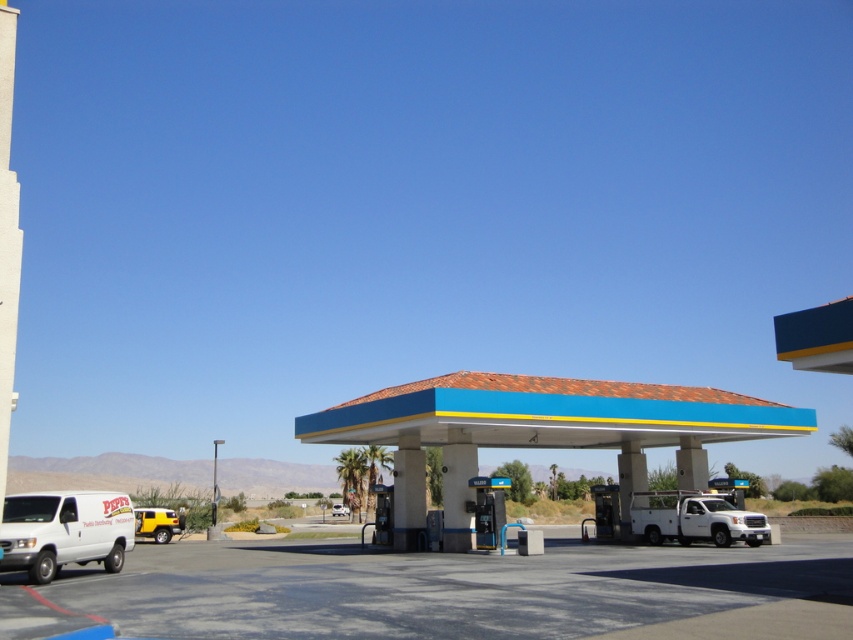
You are a delivery driver who needs to park your truck between the white matte van at lower left and the silver metallic suv at center. The truck requires a minimum of 60 meters of space to park. Can you park your truck in this location?

The distance between the white matte van at lower left and the silver metallic suv at center is 55.78 meters, which is less than the required 60 meters. Therefore, the truck cannot park between them.

You are standing at the point marked by the coordinates point (538, 429) in the image. What object are you directly at?

You are directly at the blue painted concrete gas station at center.